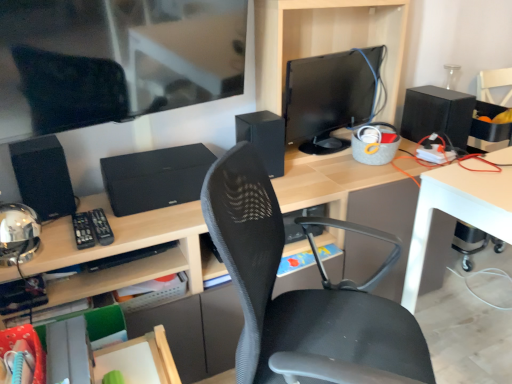
Question: Is black textured speaker at center located outside black matte speaker at center, acting as the 2th speaker starting from the back?

Choices:
 (A) no
 (B) yes

Answer: (B)

Question: Is the depth of black textured speaker at center less than that of black matte speaker at center, which is the 2th speaker in front-to-back order?

Choices:
 (A) yes
 (B) no

Answer: (A)

Question: Is black textured speaker at center oriented away from black matte speaker at center, which is the 2th speaker in right-to-left order?

Choices:
 (A) no
 (B) yes

Answer: (A)

Question: From the image's perspective, is black textured speaker at center on black matte speaker at center, which is the 2th speaker in right-to-left order?

Choices:
 (A) no
 (B) yes

Answer: (A)

Question: Does black textured speaker at center appear on the left side of black matte speaker at center, the 2th speaker from the left?

Choices:
 (A) yes
 (B) no

Answer: (A)

Question: Is point (60, 188) closer or farther from the camera than point (415, 289)?

Choices:
 (A) closer
 (B) farther

Answer: (A)

Question: Considering their positions, is black matte speaker at left, the first speaker when ordered from front to back, located in front of or behind white glossy table at lower right?

Choices:
 (A) behind
 (B) front

Answer: (A)

Question: From a real-world perspective, is black matte speaker at left, placed as the third speaker when sorted from right to left, physically located above or below white glossy table at lower right?

Choices:
 (A) below
 (B) above

Answer: (B)

Question: Is black matte speaker at left, acting as the 3th speaker starting from the back, spatially inside white glossy table at lower right, or outside of it?

Choices:
 (A) inside
 (B) outside

Answer: (B)

Question: From the image's perspective, relative to black matte speaker at right, which is the 1th speaker in back-to-front order, is black matte speaker at left, placed as the third speaker when sorted from right to left, above or below?

Choices:
 (A) below
 (B) above

Answer: (A)

Question: Choose the correct answer: Is black matte speaker at left, which appears as the first speaker when viewed from the left, inside black matte speaker at right, the 3th speaker viewed from the left, or outside it?

Choices:
 (A) outside
 (B) inside

Answer: (A)

Question: Is black matte speaker at left, placed as the third speaker when sorted from right to left, wider or thinner than black matte speaker at right, which is the 1th speaker in back-to-front order?

Choices:
 (A) thin
 (B) wide

Answer: (A)

Question: From a real-world perspective, is black matte speaker at left, the first speaker when ordered from front to back, above or below black matte speaker at right, which ranks as the 3th speaker in front-to-back order?

Choices:
 (A) below
 (B) above

Answer: (B)

Question: In terms of width, does black textured speaker at center look wider or thinner when compared to white glossy table at lower right?

Choices:
 (A) wide
 (B) thin

Answer: (B)

Question: Which is correct: black textured speaker at center is inside white glossy table at lower right, or outside of it?

Choices:
 (A) inside
 (B) outside

Answer: (B)